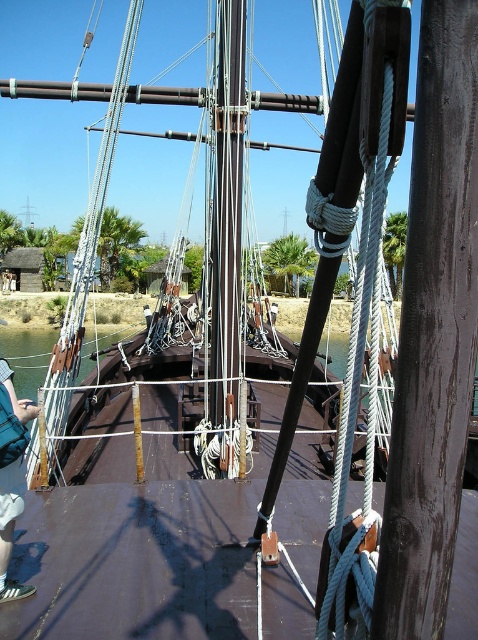
Can you confirm if dark brown wood at center is bigger than blue denim shorts at lower left?

No.

Describe the element at coordinates (433, 333) in the screenshot. The height and width of the screenshot is (640, 478). I see `dark brown wood at center` at that location.

The height and width of the screenshot is (640, 478). In order to click on dark brown wood at center in this screenshot , I will do `click(433, 333)`.